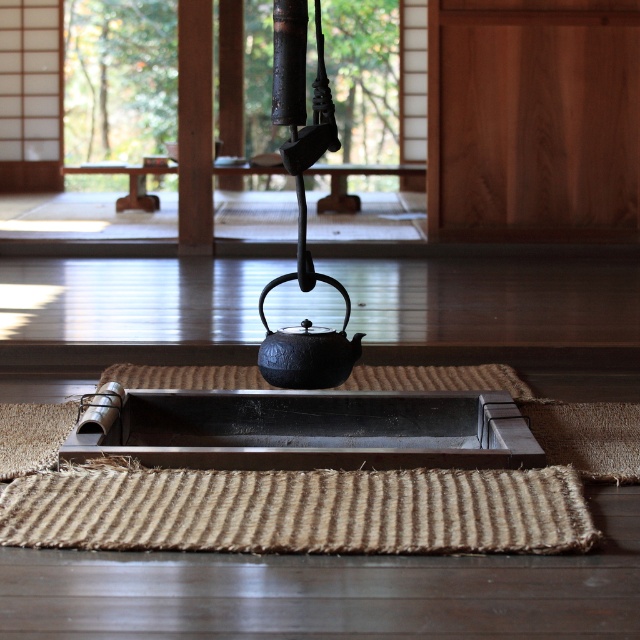
Looking at this image, does sisal rug at center appear under black cast iron teapot at center?

Correct, sisal rug at center is located below black cast iron teapot at center.

The width and height of the screenshot is (640, 640). What do you see at coordinates (436, 378) in the screenshot?
I see `sisal rug at center` at bounding box center [436, 378].

This screenshot has width=640, height=640. Describe the element at coordinates (436, 378) in the screenshot. I see `sisal rug at center` at that location.

At what (x,y) coordinates should I click in order to perform the action: click on sisal rug at center. Please return your answer as a coordinate pair (x, y). The height and width of the screenshot is (640, 640). Looking at the image, I should click on (436, 378).

Which is in front, point (156, 502) or point (436, 428)?

Point (156, 502)

Where is `natural fiber mat at lower center`? natural fiber mat at lower center is located at coordinates (298, 509).

What are the coordinates of `natural fiber mat at lower center` in the screenshot? It's located at (298, 509).

Can you confirm if shiny dark wood tray at center is positioned below sisal rug at center?

Yes, shiny dark wood tray at center is below sisal rug at center.

Which is below, shiny dark wood tray at center or sisal rug at center?

shiny dark wood tray at center

What are the coordinates of `shiny dark wood tray at center` in the screenshot? It's located at (310, 429).